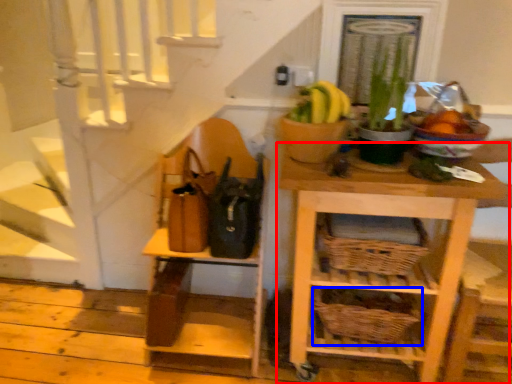
Question: Which object appears farthest to the camera in this image, shelf (highlighted by a red box) or basket (highlighted by a blue box)?

Choices:
 (A) shelf
 (B) basket

Answer: (B)